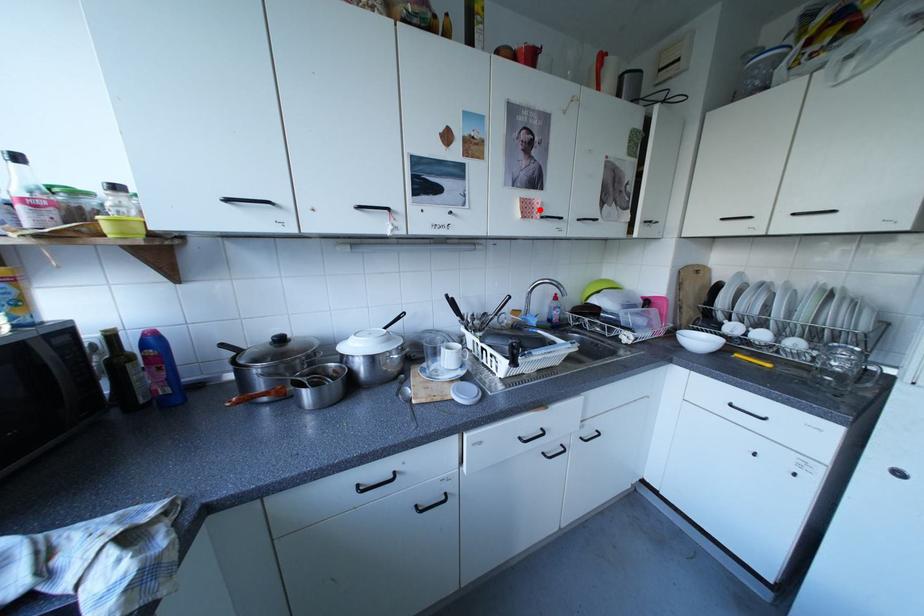
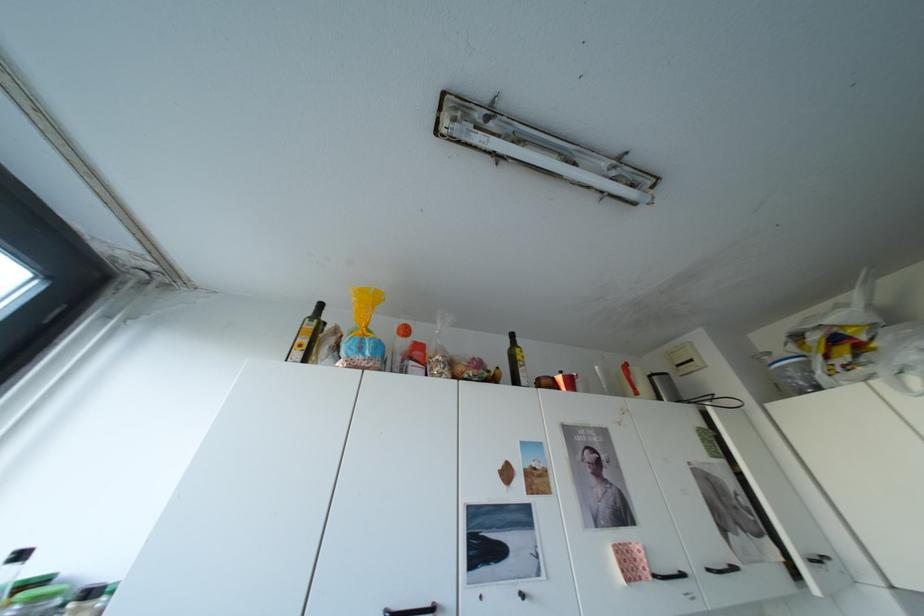
Locate, in the second image, the point that corresponds to the highlighted location in the first image.

(642, 568)